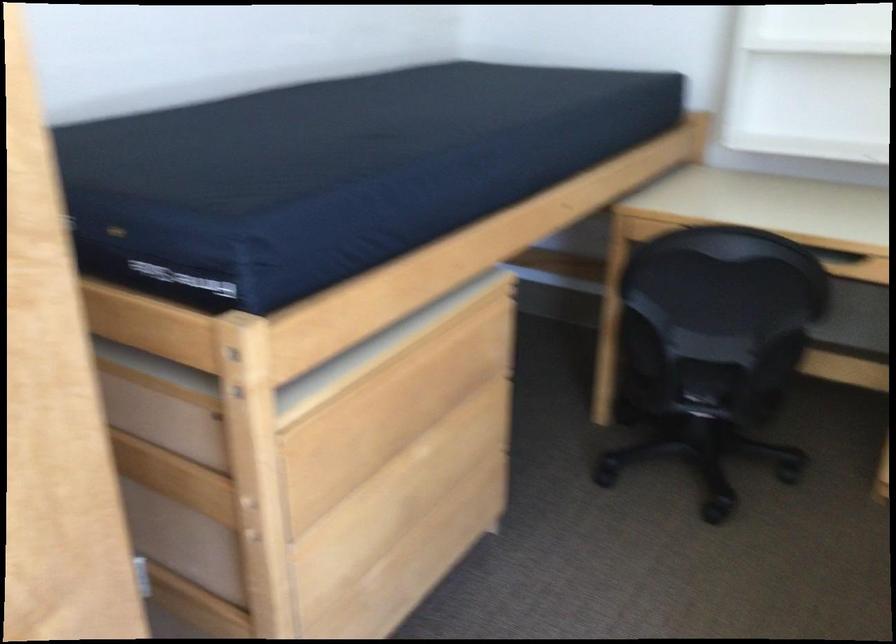
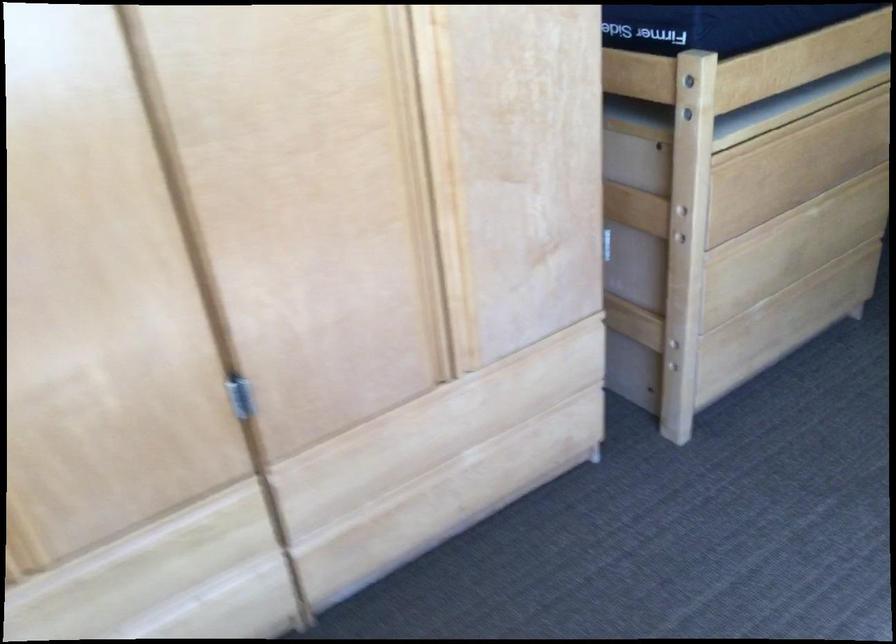
Find the pixel in the second image that matches point 256,507 in the first image.

(682, 210)